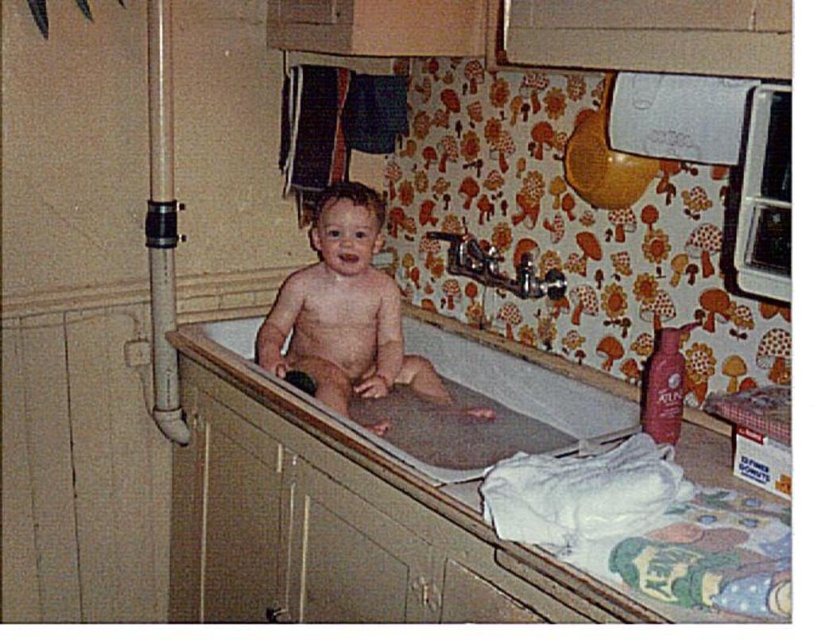
You are a babysitter who needs to ensure the baby is safe. The smooth skin baby at center is currently sitting inside the smooth plastic bathtub at center. According to the scene description, is the baby positioned safely in the bathtub?

The smooth skin baby at center is above smooth plastic bathtub at center, which means the baby is not properly seated inside the bathtub. This could be a safety hazard as the baby might fall out or slip. Ensure the baby is securely placed within the bathtub to prevent accidents.

What are the coordinates of the smooth skin baby at center?

The smooth skin baby at center is located at point (344, 310).